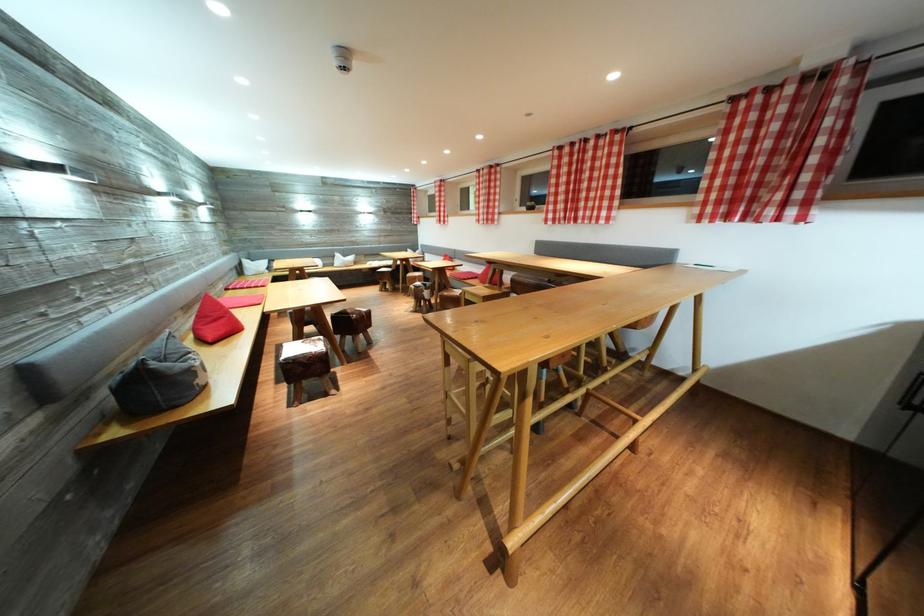
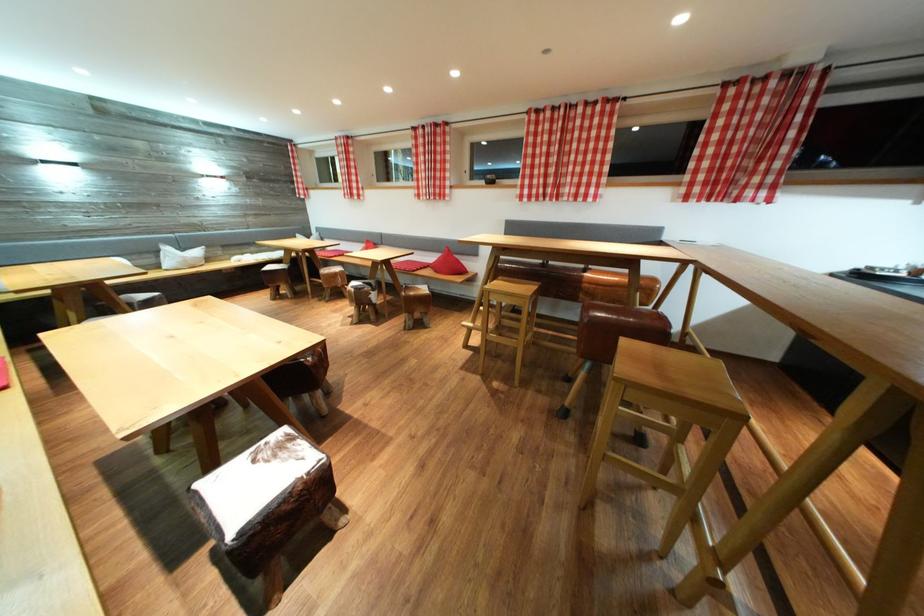
The point at (487, 275) is marked in the first image. Where is the corresponding point in the second image?

(438, 262)